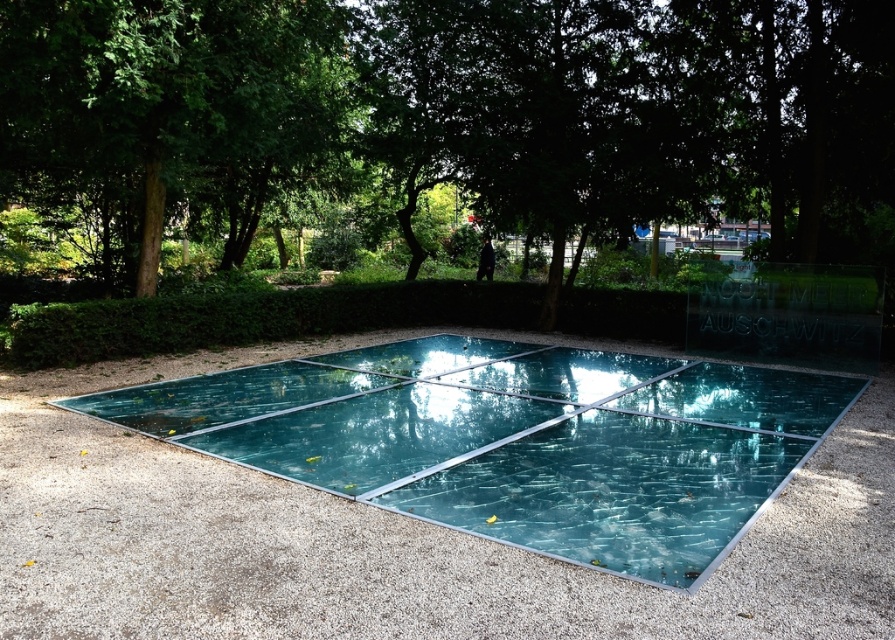
Can you confirm if green leafy tree at center is smaller than transparent glass pool at center?

No, green leafy tree at center is not smaller than transparent glass pool at center.

Can you confirm if green leafy tree at center is bigger than transparent glass pool at center?

Yes.

Locate an element on the screen. This screenshot has height=640, width=895. green leafy tree at center is located at coordinates tap(442, 125).

Is green leafy tree at center below green leafy tree at upper left?

Indeed, green leafy tree at center is positioned under green leafy tree at upper left.

Does green leafy tree at center appear over green leafy tree at upper left?

Actually, green leafy tree at center is below green leafy tree at upper left.

Image resolution: width=895 pixels, height=640 pixels. I want to click on green leafy tree at center, so click(x=442, y=125).

Can you confirm if transparent glass pool at center is positioned below green leafy tree at upper left?

Yes.

Is transparent glass pool at center above green leafy tree at upper left?

No.

Does point (606, 371) come farther from viewer compared to point (266, 20)?

That is True.

This screenshot has width=895, height=640. Identify the location of transparent glass pool at center. (516, 440).